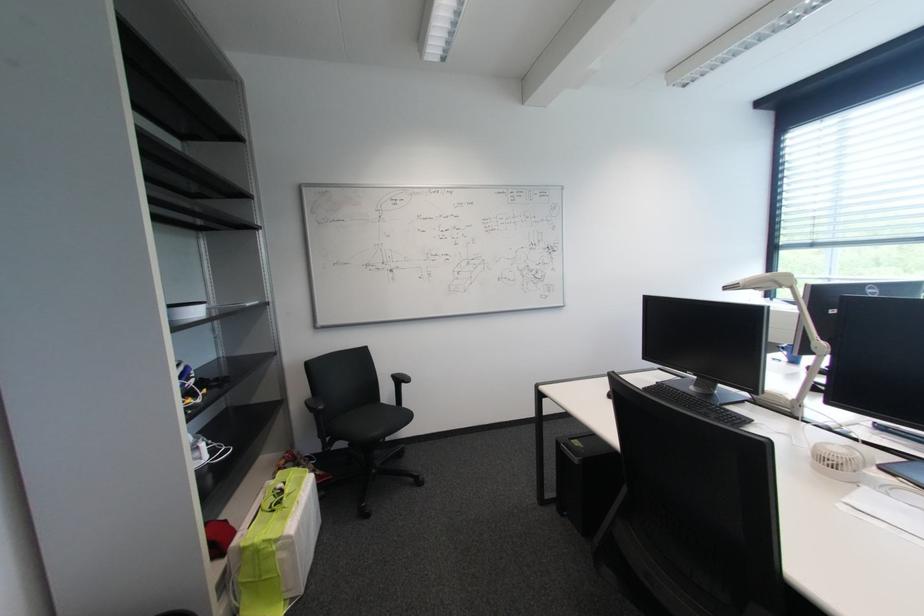
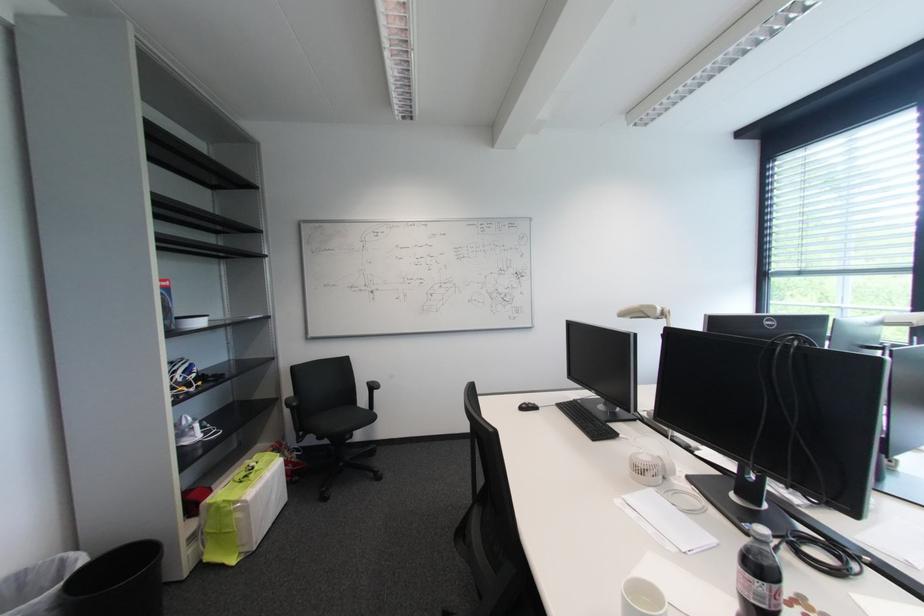
Find the pixel in the second image that matches pixel 782 283 in the first image.

(649, 314)